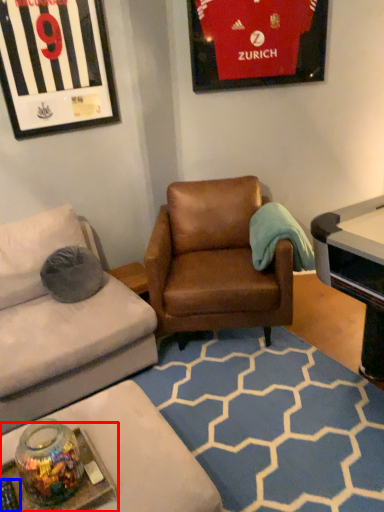
Question: Which object appears closest to the camera in this image, round table (highlighted by a red box) or remote control (highlighted by a blue box)?

Choices:
 (A) round table
 (B) remote control

Answer: (A)